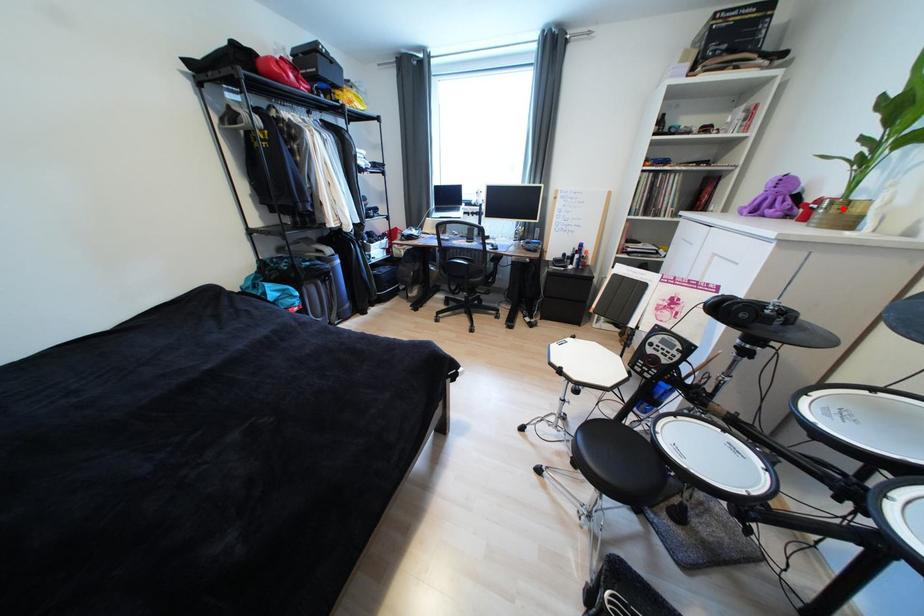
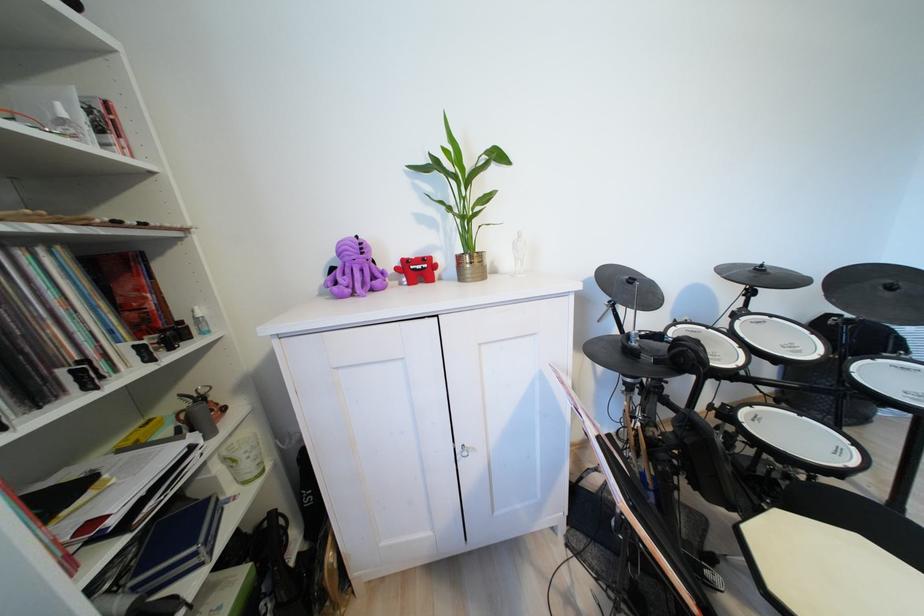
Where in the second image is the point corresponding to the highlighted location from the first image?

(482, 262)